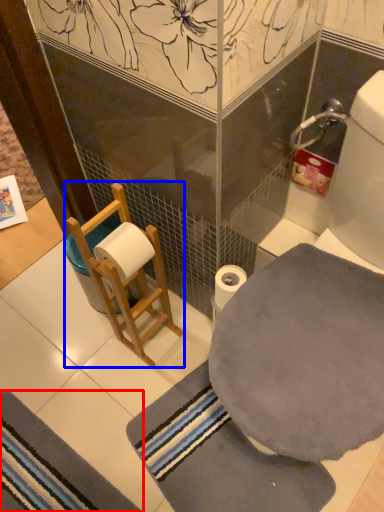
Question: Which of the following is the farthest to the observer, bath mat (highlighted by a red box) or armchair (highlighted by a blue box)?

Choices:
 (A) bath mat
 (B) armchair

Answer: (A)